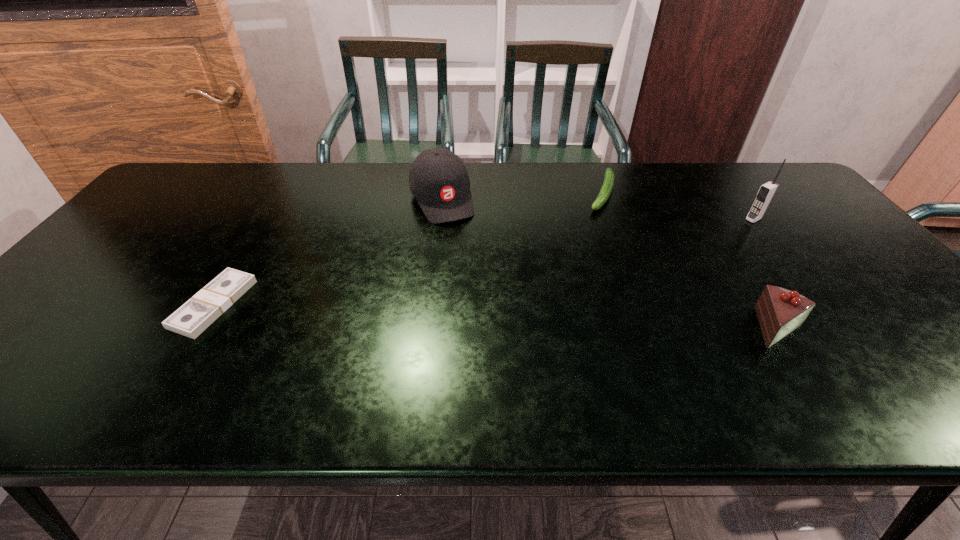
Find the location of `vacant space on the desktop that is between the shortest object and the fourth object from left to right and is positioned on the front-facing side of the fourth tallest object`. vacant space on the desktop that is between the shortest object and the fourth object from left to right and is positioned on the front-facing side of the fourth tallest object is located at coordinates (x=552, y=318).

I want to click on free spot on the desktop that is between the dollar and the fourth object from left to right and is positioned with a logo on the front of the baseball cap, so click(x=502, y=316).

Locate an element on the screen. This screenshot has width=960, height=540. free space on the desktop that is between the shortest object and the fourth object from left to right and is positioned on the front-facing side of the tallest object is located at coordinates tap(570, 319).